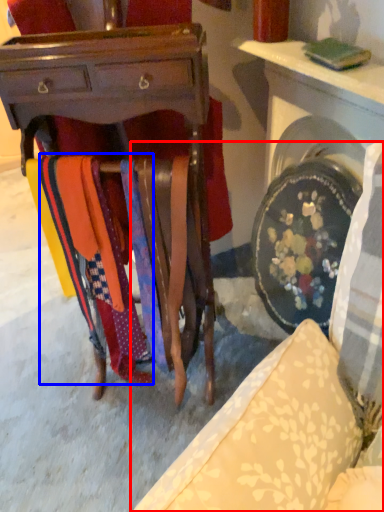
Question: Which object is closer to the camera taking this photo, furniture (highlighted by a red box) or fabric (highlighted by a blue box)?

Choices:
 (A) furniture
 (B) fabric

Answer: (B)